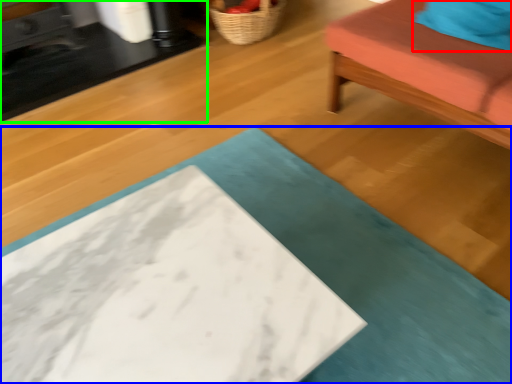
Question: Which object is the closest to the pillow (highlighted by a red box)? Choose among these: table (highlighted by a blue box) or table (highlighted by a green box).

Choices:
 (A) table
 (B) table

Answer: (A)